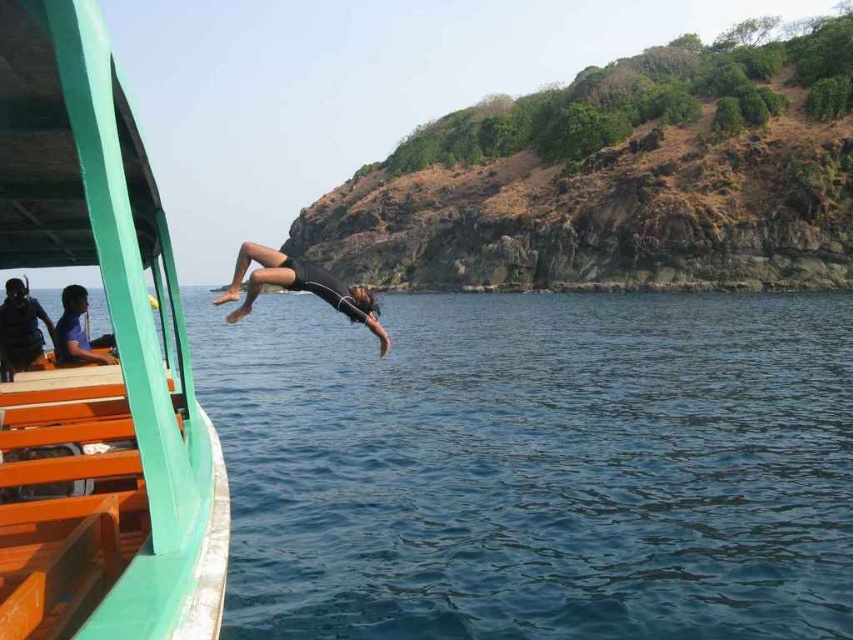
You are a photographer standing on the green painted wood boat at left. You want to take a photo of the deep blue water at center. Which direction should you tilt your camera to capture the water in the frame?

The deep blue water at center is taller than the green painted wood boat at left, so you should tilt your camera upwards to capture the water in the frame.